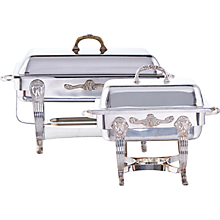
At what (x,y) coordinates should I click in order to perform the action: click on side handle large chafing dish. Please return your answer as a coordinate pair (x, y). Looking at the image, I should click on (5, 78).